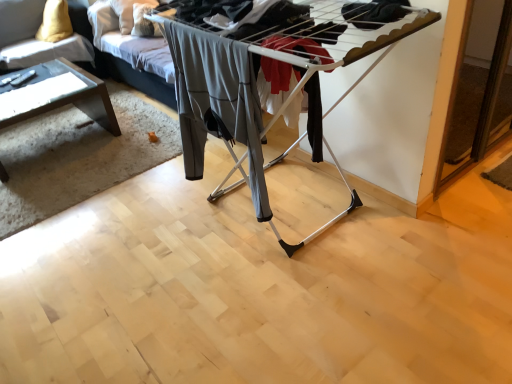
Locate an element on the screen. The height and width of the screenshot is (384, 512). clear glass table at left is located at coordinates (59, 95).

The image size is (512, 384). In order to click on clear glass table at left in this screenshot , I will do `click(59, 95)`.

Would you say clear glass table at left is inside or outside velvet yellow pillow at upper left?

clear glass table at left exists outside the volume of velvet yellow pillow at upper left.

Consider the image. Does clear glass table at left come in front of velvet yellow pillow at upper left?

That is True.

Does point (7, 108) come in front of point (5, 50)?

That is True.

Are gray fabric pants at center and velvet yellow pillow at upper left beside each other?

gray fabric pants at center is not next to velvet yellow pillow at upper left, and they're not touching.

Looking at this image, in the image, is gray fabric pants at center on the left side or the right side of velvet yellow pillow at upper left?

gray fabric pants at center is positioned on velvet yellow pillow at upper left's right side.

How distant is gray fabric pants at center from velvet yellow pillow at upper left?

gray fabric pants at center and velvet yellow pillow at upper left are 2.11 meters apart from each other.

Can you confirm if velvet yellow pillow at upper left is wider than gray fabric pants at center?

Yes.

From a real-world perspective, which is physically below, velvet yellow pillow at upper left or gray fabric pants at center?

velvet yellow pillow at upper left, from a real-world perspective.

Is velvet yellow pillow at upper left facing towards gray fabric pants at center?

No, velvet yellow pillow at upper left is not aimed at gray fabric pants at center.

Can you confirm if velvet yellow pillow at upper left is smaller than clear glass table at left?

Indeed, velvet yellow pillow at upper left has a smaller size compared to clear glass table at left.

The width and height of the screenshot is (512, 384). I want to click on table below the velvet yellow pillow at upper left (from a real-world perspective), so click(59, 95).

From the image's perspective, does velvet yellow pillow at upper left appear higher than clear glass table at left?

Correct, velvet yellow pillow at upper left appears higher than clear glass table at left in the image.

Which object is positioned more to the left, velvet yellow pillow at upper left or clear glass table at left?

velvet yellow pillow at upper left is more to the left.

Which of these two, clear glass table at left or gray fabric pants at center, is wider?

clear glass table at left is wider.

Between point (53, 107) and point (201, 142), which one is positioned behind?

The point (53, 107) is behind.

Considering the sizes of clear glass table at left and gray fabric pants at center in the image, is clear glass table at left taller or shorter than gray fabric pants at center?

Clearly, clear glass table at left is shorter compared to gray fabric pants at center.

How different are the orientations of clear glass table at left and gray fabric pants at center in degrees?

They differ by 0.29 degrees in their facing directions.

Is gray fabric pants at center facing towards clear glass table at left?

No, gray fabric pants at center is not oriented towards clear glass table at left.

Which object is wider, gray fabric pants at center or clear glass table at left?

Wider between the two is clear glass table at left.

At what (x,y) coordinates should I click in order to perform the action: click on clothing below the clear glass table at left (from the image's perspective). Please return your answer as a coordinate pair (x, y). The image size is (512, 384). Looking at the image, I should click on (217, 102).

Considering the relative sizes of gray fabric pants at center and clear glass table at left in the image provided, is gray fabric pants at center smaller than clear glass table at left?

Yes.

At what (x,y) coordinates should I click in order to perform the action: click on couch above the clear glass table at left (from a real-world perspective). Please return your answer as a coordinate pair (x, y). The height and width of the screenshot is (384, 512). Looking at the image, I should click on (34, 37).

This screenshot has height=384, width=512. Find the location of `clothing lying below the velvet yellow pillow at upper left (from the image's perspective)`. clothing lying below the velvet yellow pillow at upper left (from the image's perspective) is located at coordinates coord(217,102).

Considering their positions, is clear glass table at left positioned closer to gray fabric pants at center than velvet yellow pillow at upper left?

clear glass table at left is closer to gray fabric pants at center.

Considering their positions, is gray fabric pants at center positioned closer to clear glass table at left than velvet yellow pillow at upper left?

Based on the image, velvet yellow pillow at upper left appears to be nearer to clear glass table at left.

From the image, which object appears to be nearer to velvet yellow pillow at upper left, gray fabric pants at center or clear glass table at left?

clear glass table at left.

From the image, which object appears to be nearer to gray fabric pants at center, velvet yellow pillow at upper left or clear glass table at left?

Based on the image, clear glass table at left appears to be nearer to gray fabric pants at center.

Which object lies further to the anchor point clear glass table at left, velvet yellow pillow at upper left or gray fabric pants at center?

gray fabric pants at center is further to clear glass table at left.

Which object lies nearer to the anchor point velvet yellow pillow at upper left, clear glass table at left or gray fabric pants at center?

clear glass table at left is positioned closer to the anchor velvet yellow pillow at upper left.

Locate an element on the screen. This screenshot has height=384, width=512. table between gray fabric pants at center and velvet yellow pillow at upper left from front to back is located at coordinates (59, 95).